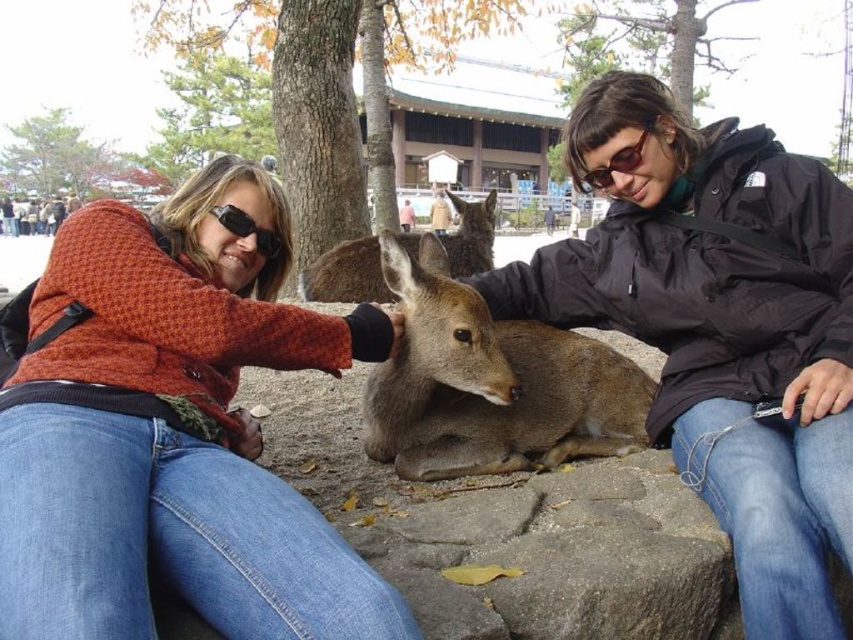
Can you confirm if matte black jacket at center is shorter than brown matte/deer at center?

No.

Does point (577, 140) come behind point (381, 388)?

No.

This screenshot has height=640, width=853. I want to click on matte black jacket at center, so click(x=721, y=328).

Does brown fur deer at center have a smaller size compared to matte black sunglasses at center?

Incorrect, brown fur deer at center is not smaller in size than matte black sunglasses at center.

Between brown fur deer at center and matte black sunglasses at center, which one appears on the left side from the viewer's perspective?

From the viewer's perspective, brown fur deer at center appears more on the left side.

Who is more forward, (363,248) or (221,212)?

Point (221,212) is in front.

Locate an element on the screen. brown fur deer at center is located at coordinates (346, 275).

Can you confirm if brown matte/deer at center is smaller than matte black sunglasses at center?

Actually, brown matte/deer at center might be larger than matte black sunglasses at center.

Between brown matte/deer at center and matte black sunglasses at center, which one has more height?

Standing taller between the two is brown matte/deer at center.

Find the location of a particular element. brown matte/deer at center is located at coordinates (490, 384).

Where is `brown matte/deer at center`? brown matte/deer at center is located at coordinates (490, 384).